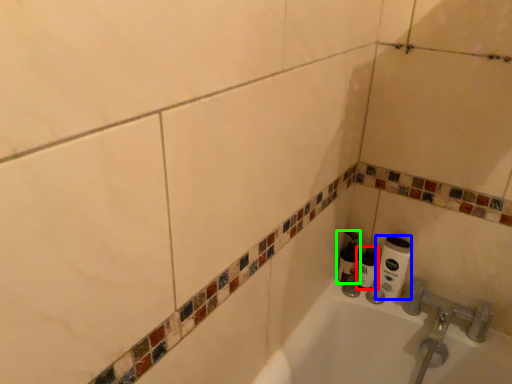
Question: Which is nearer to the shaving cream (highlighted by a red box)? toilet paper (highlighted by a blue box) or shaving cream (highlighted by a green box).

Choices:
 (A) toilet paper
 (B) shaving cream

Answer: (B)